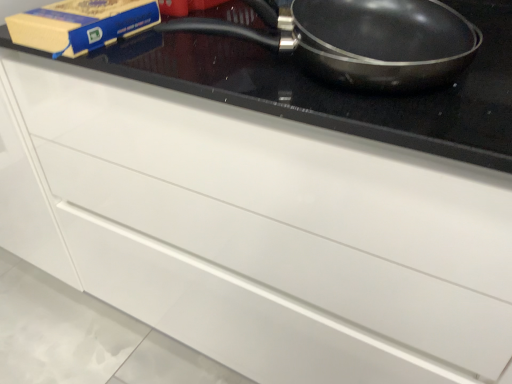
This screenshot has height=384, width=512. What do you see at coordinates (360, 40) in the screenshot?
I see `black non-stick frying pan at upper right` at bounding box center [360, 40].

In order to face black non-stick frying pan at upper right, should I rotate leftwards or rightwards?

It's best to rotate right around 10.343 degrees.

The image size is (512, 384). What are the coordinates of `black non-stick frying pan at upper right` in the screenshot? It's located at (360, 40).

Where is `matte blue paperback book at upper left`? The image size is (512, 384). matte blue paperback book at upper left is located at coordinates (81, 24).

This screenshot has height=384, width=512. Describe the element at coordinates (81, 24) in the screenshot. I see `matte blue paperback book at upper left` at that location.

I want to click on black non-stick frying pan at upper right, so click(360, 40).

Is black non-stick frying pan at upper right to the left of matte blue paperback book at upper left from the viewer's perspective?

Incorrect, black non-stick frying pan at upper right is not on the left side of matte blue paperback book at upper left.

Does black non-stick frying pan at upper right come behind matte blue paperback book at upper left?

No, it is in front of matte blue paperback book at upper left.

Between point (388, 41) and point (122, 34), which one is positioned behind?

The point (122, 34) is farther.

From the image's perspective, who appears lower, black non-stick frying pan at upper right or matte blue paperback book at upper left?

black non-stick frying pan at upper right, from the image's perspective.

From a real-world perspective, which is physically below, black non-stick frying pan at upper right or matte blue paperback book at upper left?

matte blue paperback book at upper left.

Between black non-stick frying pan at upper right and matte blue paperback book at upper left, which one has larger width?

black non-stick frying pan at upper right.

Between black non-stick frying pan at upper right and matte blue paperback book at upper left, which one has more height?

black non-stick frying pan at upper right is taller.

Can you confirm if black non-stick frying pan at upper right is bigger than matte blue paperback book at upper left?

Correct, black non-stick frying pan at upper right is larger in size than matte blue paperback book at upper left.

Can matte blue paperback book at upper left be found inside black non-stick frying pan at upper right?

Definitely not — matte blue paperback book at upper left is not inside black non-stick frying pan at upper right.

Does black non-stick frying pan at upper right touch matte blue paperback book at upper left?

No, black non-stick frying pan at upper right is not touching matte blue paperback book at upper left.

Is black non-stick frying pan at upper right facing towards matte blue paperback book at upper left?

No, black non-stick frying pan at upper right is not oriented towards matte blue paperback book at upper left.

Can you tell me how much black non-stick frying pan at upper right and matte blue paperback book at upper left differ in facing direction?

The facing directions of black non-stick frying pan at upper right and matte blue paperback book at upper left are 0.000917 degrees apart.

Find the location of `frying pan that is above the matte blue paperback book at upper left (from a real-world perspective)`. frying pan that is above the matte blue paperback book at upper left (from a real-world perspective) is located at coordinates (360, 40).

Which object is positioned more to the left, matte blue paperback book at upper left or black non-stick frying pan at upper right?

Positioned to the left is matte blue paperback book at upper left.

Considering the positions of objects matte blue paperback book at upper left and black non-stick frying pan at upper right in the image provided, who is behind, matte blue paperback book at upper left or black non-stick frying pan at upper right?

matte blue paperback book at upper left is further from the camera.

Does point (67, 12) come closer to viewer compared to point (379, 58)?

No.

From the image's perspective, which is above, matte blue paperback book at upper left or black non-stick frying pan at upper right?

matte blue paperback book at upper left.

From a real-world perspective, who is located higher, matte blue paperback book at upper left or black non-stick frying pan at upper right?

black non-stick frying pan at upper right, from a real-world perspective.

Can you confirm if matte blue paperback book at upper left is thinner than black non-stick frying pan at upper right?

Indeed, matte blue paperback book at upper left has a lesser width compared to black non-stick frying pan at upper right.

Is matte blue paperback book at upper left taller than black non-stick frying pan at upper right?

Result: No, matte blue paperback book at upper left is not taller than black non-stick frying pan at upper right.

Does matte blue paperback book at upper left have a larger size compared to black non-stick frying pan at upper right?

No, matte blue paperback book at upper left is not bigger than black non-stick frying pan at upper right.

Is black non-stick frying pan at upper right inside matte blue paperback book at upper left?

No, matte blue paperback book at upper left does not contain black non-stick frying pan at upper right.

Is matte blue paperback book at upper left with black non-stick frying pan at upper right?

No, matte blue paperback book at upper left is not with black non-stick frying pan at upper right.

Is matte blue paperback book at upper left looking in the opposite direction of black non-stick frying pan at upper right?

No, matte blue paperback book at upper left's orientation is not away from black non-stick frying pan at upper right.

How much distance is there between matte blue paperback book at upper left and black non-stick frying pan at upper right?

matte blue paperback book at upper left is 12.75 inches from black non-stick frying pan at upper right.

What are the coordinates of `paperback book above the black non-stick frying pan at upper right (from the image's perspective)` in the screenshot? It's located at (81, 24).

Locate an element on the screen. paperback book behind the black non-stick frying pan at upper right is located at coordinates (81, 24).

Locate an element on the screen. This screenshot has height=384, width=512. frying pan located in front of the matte blue paperback book at upper left is located at coordinates (360, 40).